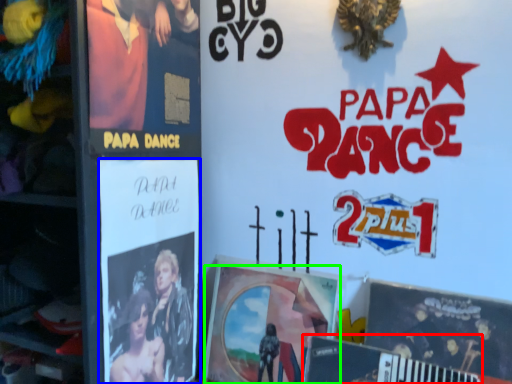
Question: Based on their relative distances, which object is nearer to magazine (highlighted by a red box)? Choose from poster (highlighted by a blue box) and poster (highlighted by a green box).

Choices:
 (A) poster
 (B) poster

Answer: (B)